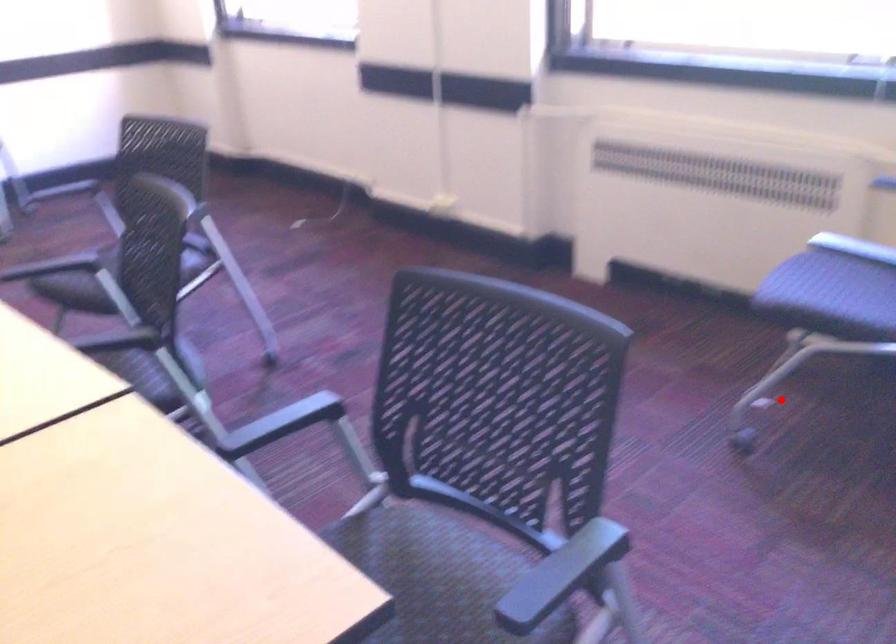
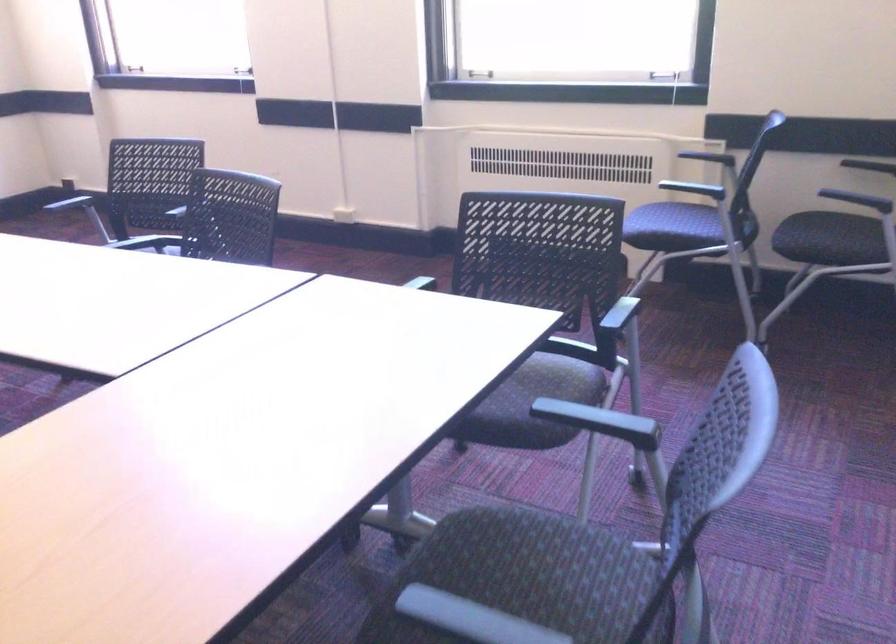
The point at the highlighted location is marked in the first image. Where is the corresponding point in the second image?

(641, 308)